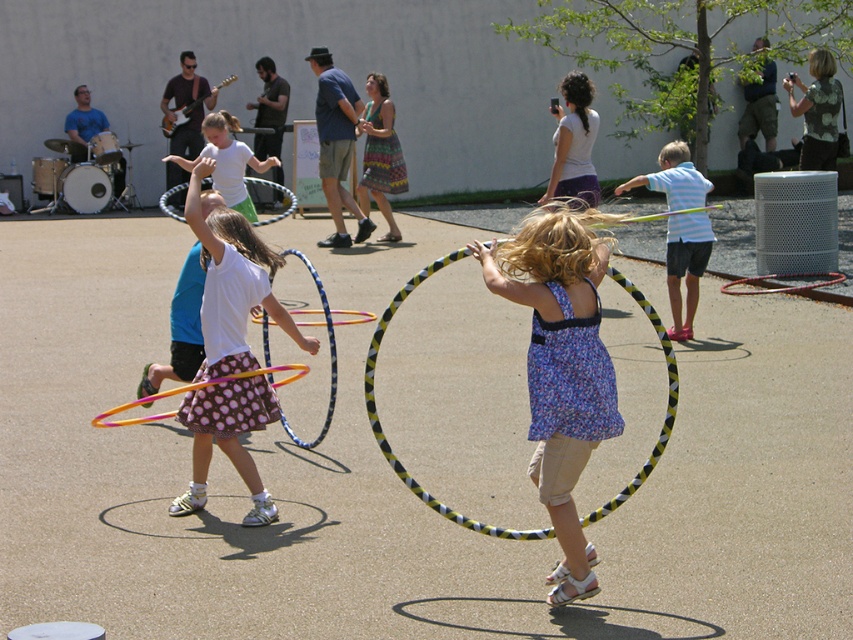
You are a photographer trying to capture both the floral fabric dress at center and the yellow and black striped hula hoop at center in a single frame. Which object should you focus on first to ensure both are in the frame?

The floral fabric dress at center is smaller in size compared to the yellow and black striped hula hoop at center, so you should focus on the yellow and black striped hula hoop at center first to ensure both fit within the frame.

You are a child trying to choose between the white matte hula hoop at center and the white plastic hula hoop at center. Which one is thinner?

The white matte hula hoop at center is thinner than the white plastic hula hoop at center.

You are a photographer trying to capture a clear picture of both the white cotton shirt at center and the light blue striped shirt at right. Which shirt should you focus on first to ensure it appears sharp in the photo?

The white cotton shirt at center is larger in size than the light blue striped shirt at right, so focusing on the white cotton shirt at center first would ensure it appears sharp, and the smaller light blue striped shirt at right will also be in focus due to its proximity in depth.